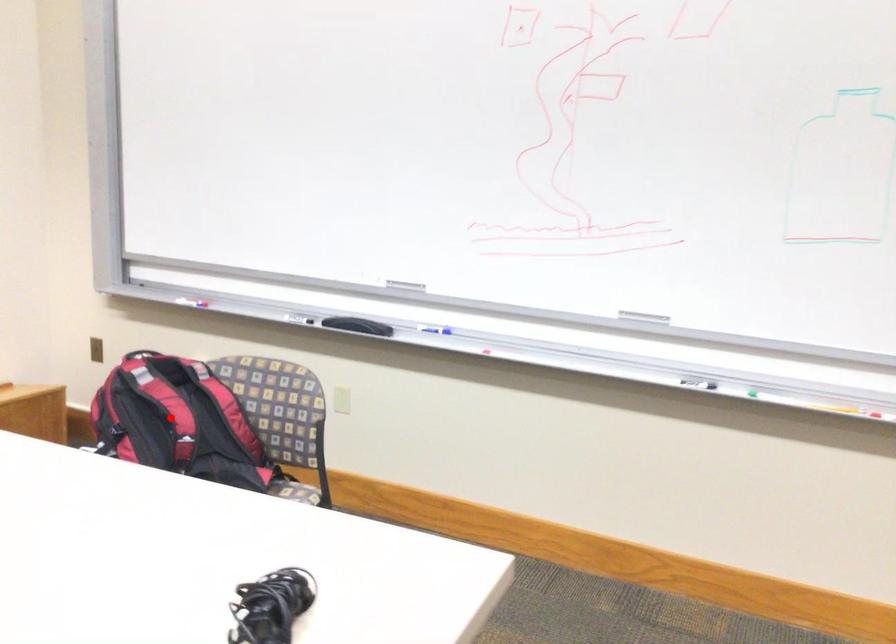
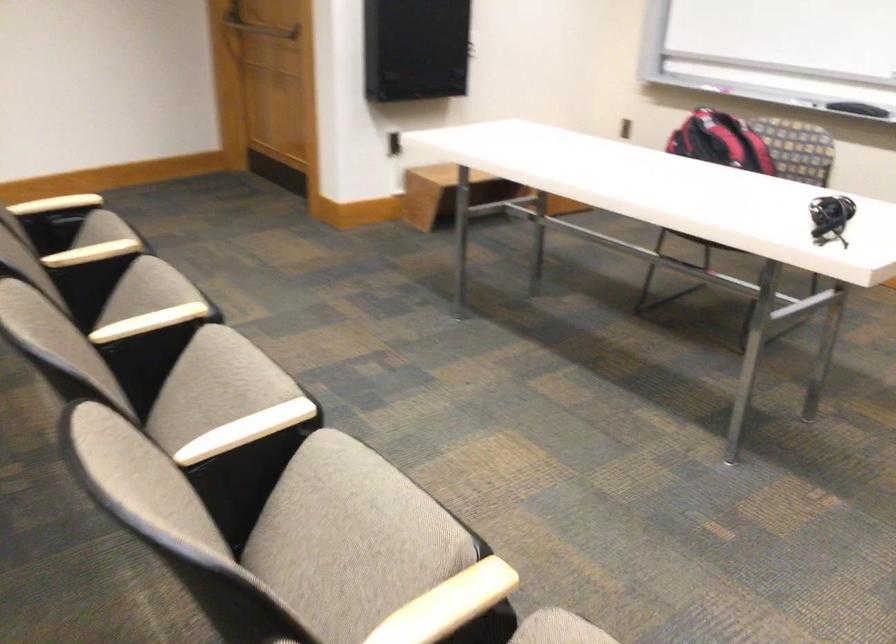
Find the pixel in the second image that matches the highlighted location in the first image.

(720, 142)